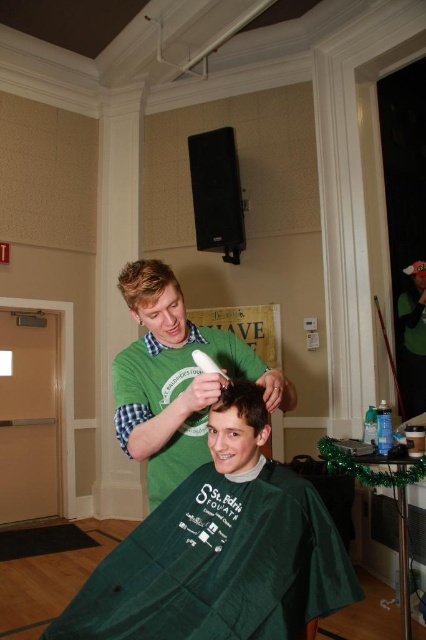
You are a photographer taking a photo of the green fabric cape at center and the brown matte hair at center. Which object should you focus on first if you want to ensure both are in focus, considering their sizes?

The green fabric cape at center has a larger size compared to brown matte hair at center, so you should focus on the larger object first to ensure both are in focus.

You are a photographer in the room and want to take a photo of the green matte shirt at center and brown matte hair at center. Which object should you focus on first if you want to capture both in the same frame without moving the camera?

The green matte shirt at center is to the left of brown matte hair at center, so you should focus on the green matte shirt at center first to ensure both are in frame.

You are organizing a St. Baldrick event and need to determine which item takes up more space in the storage box. Which is larger, the green fabric cape at center or the green matte shirt at center?

The green matte shirt at center is larger than the green fabric cape at center, so it takes up more space in the storage box.